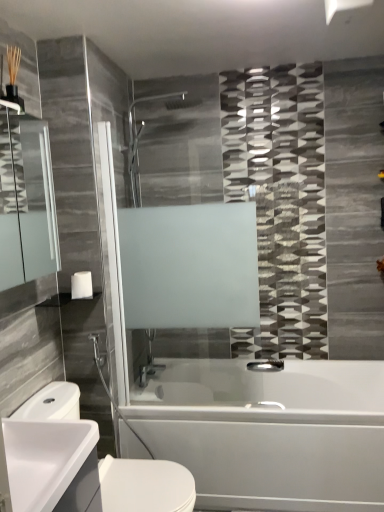
What is the approximate height of white glossy bathtub at lower center?

white glossy bathtub at lower center is 20.69 inches tall.

What are the coordinates of `white glossy bathtub at lower center` in the screenshot? It's located at (269, 431).

Locate an element on the screen. The height and width of the screenshot is (512, 384). white glossy sink at lower left is located at coordinates (82, 463).

Describe the element at coordinates (81, 285) in the screenshot. I see `white matte toilet paper at lower left` at that location.

The image size is (384, 512). Identify the location of white glossy bathtub at lower center. (269, 431).

How different are the orientations of polished chrome faucet at lower center and white glossy sink at lower left in degrees?

They differ by 95.3 degrees in their facing directions.

Between polished chrome faucet at lower center and white glossy sink at lower left, which one appears on the left side from the viewer's perspective?

white glossy sink at lower left is more to the left.

This screenshot has height=512, width=384. Identify the location of counter top above the polished chrome faucet at lower center (from a real-world perspective). (44, 459).

In the scene shown: Does matte glass mirror at left have a greater height compared to white glossy sink at lower left?

In fact, matte glass mirror at left may be shorter than white glossy sink at lower left.

Is matte glass mirror at left smaller than white glossy sink at lower left?

Correct, matte glass mirror at left occupies less space than white glossy sink at lower left.

From a real-world perspective, is matte glass mirror at left positioned under white glossy sink at lower left based on gravity?

No.

Is white glossy towel bar at upper left facing away from matte glass mirror at left?

No, white glossy towel bar at upper left's orientation is not away from matte glass mirror at left.

You are a GUI agent. You are given a task and a screenshot of the screen. Output one action in this format:
    pyautogui.click(x=<x>, y=<y>)
    Task: Click on the towel bar lying behind the matte glass mirror at left
    
    Given the screenshot: What is the action you would take?
    pyautogui.click(x=11, y=105)

Consider the image. Between white glossy towel bar at upper left and matte glass mirror at left, which one has smaller size?

white glossy towel bar at upper left.

Is point (8, 101) behind point (49, 158)?

No, (8, 101) is closer to viewer.

Does white matte toilet paper at lower left lie in front of matte glass mirror at left?

That is False.

Between white matte toilet paper at lower left and matte glass mirror at left, which one has larger size?

matte glass mirror at left.

Is white matte toilet paper at lower left not within matte glass mirror at left?

Indeed, white matte toilet paper at lower left is completely outside matte glass mirror at left.

From a real-world perspective, who is located higher, white matte toilet paper at lower left or matte glass mirror at left?

matte glass mirror at left, from a real-world perspective.

Considering the sizes of objects white glossy sink at lower left and white glossy bathtub at lower center in the image provided, who is bigger, white glossy sink at lower left or white glossy bathtub at lower center?

Bigger between the two is white glossy bathtub at lower center.

Are white glossy sink at lower left and white glossy bathtub at lower center far apart?

No, white glossy sink at lower left is not far away from white glossy bathtub at lower center.

How far apart are white glossy sink at lower left and white glossy bathtub at lower center?

The distance of white glossy sink at lower left from white glossy bathtub at lower center is 39.34 inches.

How far apart are white matte toilet paper at lower left and white glossy sink at lower left?

A distance of 31.10 inches exists between white matte toilet paper at lower left and white glossy sink at lower left.

Identify the location of toilet paper that is above the white glossy sink at lower left (from the image's perspective). (81, 285).

Is white matte toilet paper at lower left positioned with its back to white glossy sink at lower left?

white matte toilet paper at lower left does not have its back to white glossy sink at lower left.

Which is closer to the camera, (90, 279) or (62, 476)?

The point (62, 476) is closer to the camera.

Between polished chrome faucet at lower center and white matte toilet paper at lower left, which one has larger width?

white matte toilet paper at lower left is wider.

Can you confirm if polished chrome faucet at lower center is taller than white matte toilet paper at lower left?

Incorrect, the height of polished chrome faucet at lower center is not larger of that of white matte toilet paper at lower left.

From a real-world perspective, which object rests below the other?

From a 3D spatial view, polished chrome faucet at lower center is below.

Which is behind, point (270, 365) or point (88, 297)?

Positioned behind is point (270, 365).

The image size is (384, 512). Find the location of `counter top on the left of the polished chrome faucet at lower center`. counter top on the left of the polished chrome faucet at lower center is located at coordinates (44, 459).

Identify the location of sink that is behind the matte glass mirror at left. (82, 463).

Based on their spatial positions, is polished chrome faucet at lower center or white glossy sink at lower left further from white glossy sink at lower left?

Based on the image, polished chrome faucet at lower center appears to be further to white glossy sink at lower left.

From the image, which object appears to be farther from polished chrome faucet at lower center, white matte toilet paper at lower left or white glossy sink at lower left?

white glossy sink at lower left lies further to polished chrome faucet at lower center than the other object.

From the picture: Based on their spatial positions, is white matte toilet paper at lower left or polished chrome faucet at lower center closer to matte glass mirror at left?

The object closer to matte glass mirror at left is white matte toilet paper at lower left.

Based on their spatial positions, is white glossy sink at lower left or white glossy bathtub at lower center further from white glossy sink at lower left?

white glossy bathtub at lower center.

Based on their spatial positions, is matte glass mirror at left or white matte toilet paper at lower left further from white glossy bathtub at lower center?

The object further to white glossy bathtub at lower center is matte glass mirror at left.

Considering their positions, is matte glass mirror at left positioned closer to white glossy sink at lower left than white glossy towel bar at upper left?

The object closer to white glossy sink at lower left is matte glass mirror at left.

Considering their positions, is white glossy sink at lower left positioned closer to white glossy towel bar at upper left than white glossy sink at lower left?

white glossy sink at lower left is closer to white glossy towel bar at upper left.

Consider the image. Looking at the image, which one is located further to matte glass mirror at left, white glossy bathtub at lower center or white glossy sink at lower left?

Based on the image, white glossy bathtub at lower center appears to be further to matte glass mirror at left.

You are a GUI agent. You are given a task and a screenshot of the screen. Output one action in this format:
    pyautogui.click(x=<x>, y=<y>)
    Task: Click on the toilet paper that lies between white glossy towel bar at upper left and polished chrome faucet at lower center from top to bottom
    
    Given the screenshot: What is the action you would take?
    pyautogui.click(x=81, y=285)

At what (x,y) coordinates should I click in order to perform the action: click on bathtub located between white glossy sink at lower left and polished chrome faucet at lower center in the depth direction. Please return your answer as a coordinate pair (x, y). This screenshot has height=512, width=384. Looking at the image, I should click on (269, 431).

Where is `toilet paper between white glossy sink at lower left and polished chrome faucet at lower center from front to back`? Image resolution: width=384 pixels, height=512 pixels. toilet paper between white glossy sink at lower left and polished chrome faucet at lower center from front to back is located at coordinates (81, 285).

Identify the location of toilet paper between matte glass mirror at left and white glossy bathtub at lower center from top to bottom. This screenshot has height=512, width=384. (81, 285).